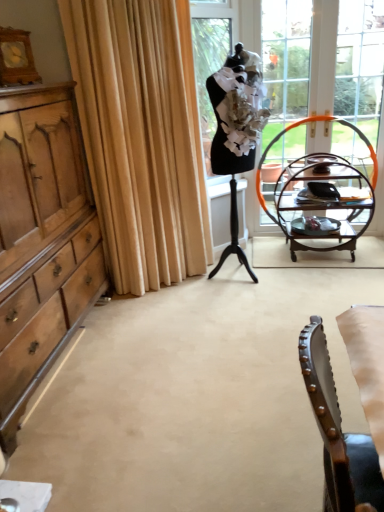
Question: Considering the positions of wooden desk at right and beige fabric curtain at left in the image, is wooden desk at right wider or thinner than beige fabric curtain at left?

Choices:
 (A) thin
 (B) wide

Answer: (B)

Question: In terms of height, does wooden desk at right look taller or shorter compared to beige fabric curtain at left?

Choices:
 (A) short
 (B) tall

Answer: (A)

Question: Considering the real-world distances, which object is closest to the clear glass window at upper right?

Choices:
 (A) beige fabric curtain at left
 (B) light brown wood cabinet at left
 (C) brown leather chair at lower right
 (D) wooden desk at right

Answer: (D)

Question: Which object is the closest to the brown leather chair at lower right?

Choices:
 (A) beige fabric curtain at left
 (B) light brown wood cabinet at left
 (C) wooden desk at right
 (D) clear glass window at upper right

Answer: (B)